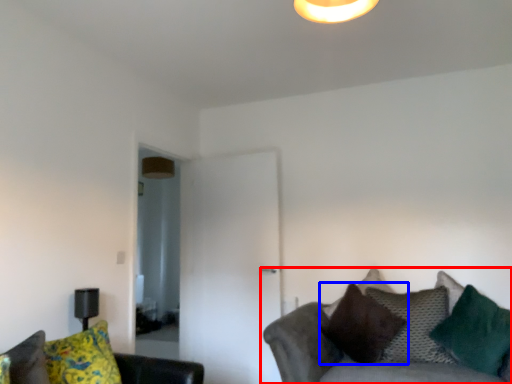
Question: Which object is further to the camera taking this photo, studio couch (highlighted by a red box) or pillow (highlighted by a blue box)?

Choices:
 (A) studio couch
 (B) pillow

Answer: (B)